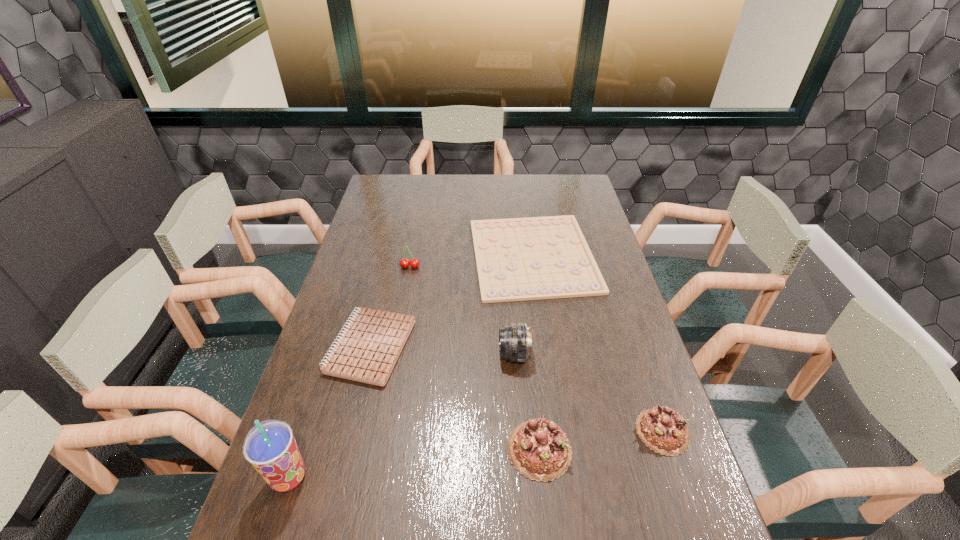
Locate an element on the screen. This screenshot has height=540, width=960. smoothie that is at the left edge is located at coordinates (270, 447).

This screenshot has width=960, height=540. I want to click on chocolate cake positioned at the right edge, so point(662,429).

The image size is (960, 540). In order to click on gameboard present at the right edge in this screenshot , I will do `click(517, 259)`.

At what (x,y) coordinates should I click in order to perform the action: click on object that is at the near left corner. Please return your answer as a coordinate pair (x, y). This screenshot has height=540, width=960. Looking at the image, I should click on (270, 447).

In the image, there is a desktop. Identify the location of free region at the far edge. [547, 200].

What are the coordinates of `vacant space at the near edge of the desktop` in the screenshot? It's located at (538, 525).

In the image, there is a desktop. Where is `vacant space at the left edge`? vacant space at the left edge is located at coordinates (375, 229).

You are a GUI agent. You are given a task and a screenshot of the screen. Output one action in this format:
    pyautogui.click(x=<x>, y=<y>)
    Task: Click on the vacant region at the right edge of the desktop
    This screenshot has width=960, height=540.
    Given the screenshot: What is the action you would take?
    pyautogui.click(x=582, y=211)

Find the location of a particular element. The image size is (960, 540). vacant space at the far left corner is located at coordinates (384, 187).

This screenshot has width=960, height=540. Find the location of `free space between the smoothie and the fifth tallest object`. free space between the smoothie and the fifth tallest object is located at coordinates (475, 455).